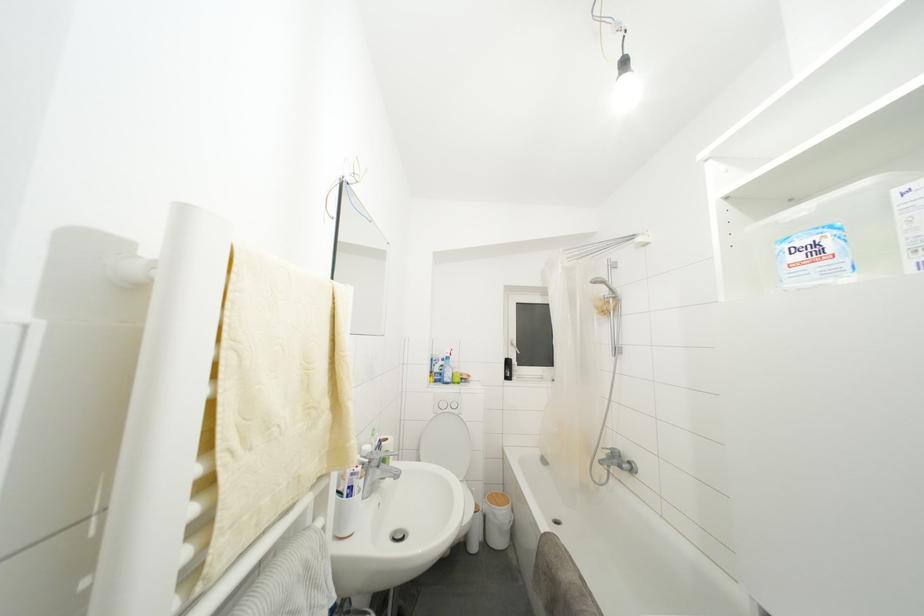
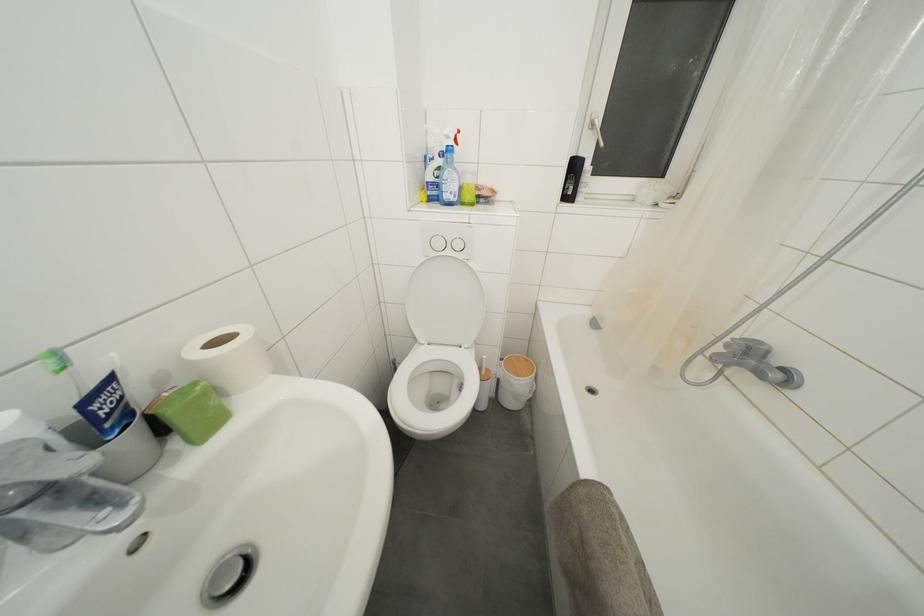
Where in the second image is the point corresponding to pixel 517 350 from the first image?

(597, 131)